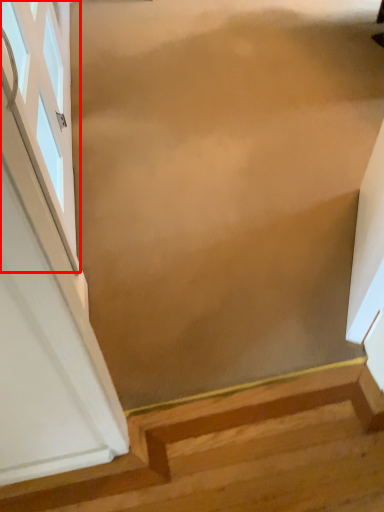
Question: From the image, what is the correct spatial relationship of window (annotated by the red box) in relation to stairs?

Choices:
 (A) left
 (B) right

Answer: (A)